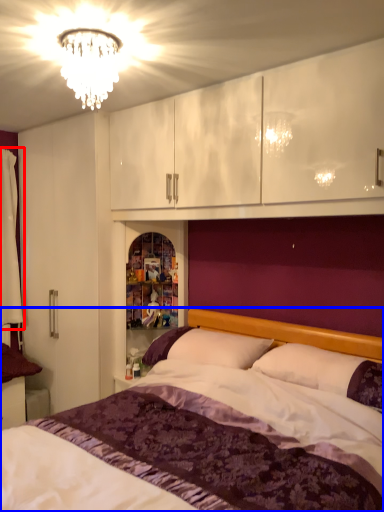
Question: Which of the following is the closest to the observer, curtain (highlighted by a red box) or bed (highlighted by a blue box)?

Choices:
 (A) curtain
 (B) bed

Answer: (B)